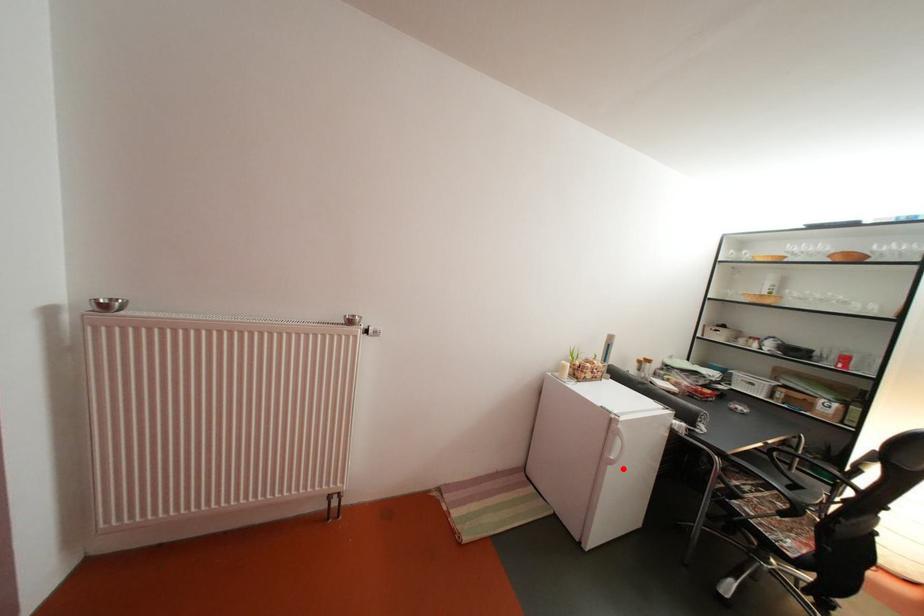
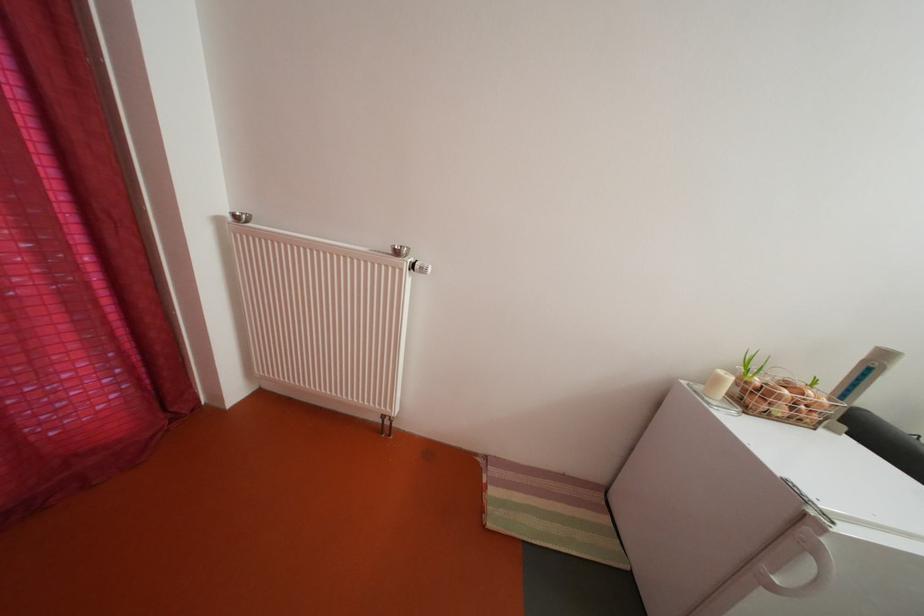
Question: I am providing you with two images of the same scene from different viewpoints. Image1 has a red point marked. In image2, the corresponding 3D location appears at what relative position? Reply with the corresponding letter.

Choices:
 (A) Closer
 (B) Farther

Answer: (A)